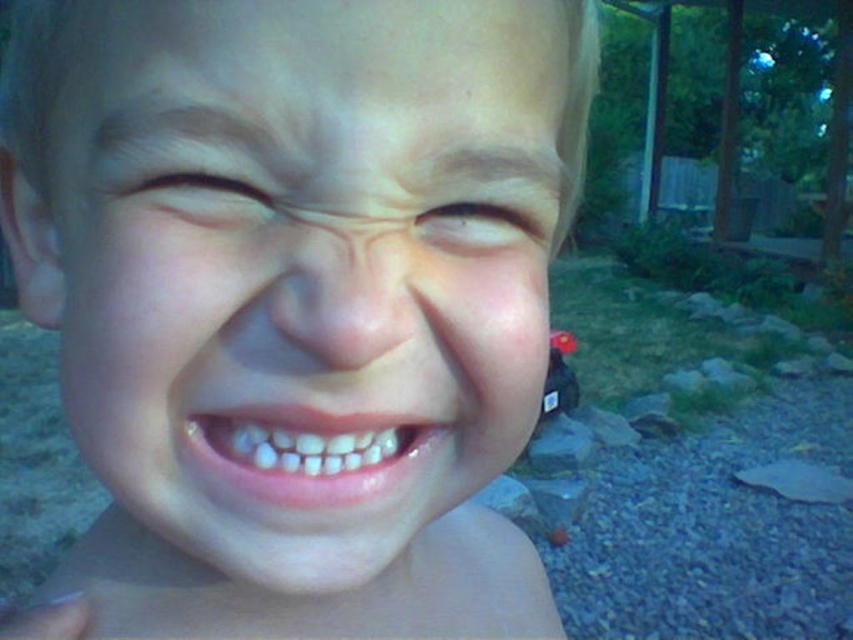
Question: Can you confirm if smooth skin face at center is positioned to the right of skin at center?

Choices:
 (A) yes
 (B) no

Answer: (A)

Question: Which point is closer to the camera?

Choices:
 (A) white glossy teeth at center
 (B) brown matte eye at upper center
 (C) skin at center

Answer: (A)

Question: Which of these objects is positioned closest to the skin at center?

Choices:
 (A) smooth skin face at center
 (B) brown matte eye at upper center

Answer: (A)

Question: Can you confirm if skin at center is positioned to the right of brown matte eye at upper center?

Choices:
 (A) no
 (B) yes

Answer: (A)

Question: Among these points, which one is nearest to the camera?

Choices:
 (A) 527,300
 (B) 187,566

Answer: (A)

Question: Is white glossy teeth at center positioned before brown matte eye at upper center?

Choices:
 (A) no
 (B) yes

Answer: (B)